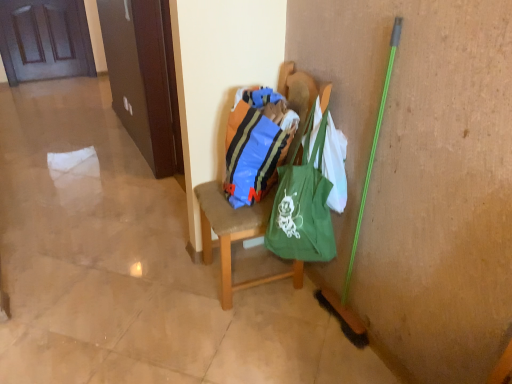
Question: Is green canvas tote at center surrounding wooden chair at center?

Choices:
 (A) yes
 (B) no

Answer: (B)

Question: Is green canvas tote at center positioned beyond the bounds of wooden chair at center?

Choices:
 (A) yes
 (B) no

Answer: (A)

Question: Considering the relative sizes of green canvas tote at center and wooden chair at center in the image provided, is green canvas tote at center wider than wooden chair at center?

Choices:
 (A) no
 (B) yes

Answer: (A)

Question: Can you see green canvas tote at center touching wooden chair at center?

Choices:
 (A) no
 (B) yes

Answer: (A)

Question: Could you tell me if green canvas tote at center is facing wooden chair at center?

Choices:
 (A) no
 (B) yes

Answer: (A)

Question: Is green canvas tote at center at the left side of wooden chair at center?

Choices:
 (A) yes
 (B) no

Answer: (B)

Question: Is green canvas tote at center facing away from blue striped fabric bag at center?

Choices:
 (A) yes
 (B) no

Answer: (B)

Question: Does green canvas tote at center have a greater width compared to blue striped fabric bag at center?

Choices:
 (A) yes
 (B) no

Answer: (A)

Question: Is blue striped fabric bag at center completely or partially inside green canvas tote at center?

Choices:
 (A) yes
 (B) no

Answer: (B)

Question: Can you confirm if green canvas tote at center is positioned to the left of blue striped fabric bag at center?

Choices:
 (A) yes
 (B) no

Answer: (B)

Question: Is green canvas tote at center smaller than blue striped fabric bag at center?

Choices:
 (A) no
 (B) yes

Answer: (A)

Question: Is green canvas tote at center not inside blue striped fabric bag at center?

Choices:
 (A) yes
 (B) no

Answer: (A)

Question: Considering the relative sizes of blue striped fabric bag at center and green canvas tote at center in the image provided, is blue striped fabric bag at center smaller than green canvas tote at center?

Choices:
 (A) yes
 (B) no

Answer: (A)